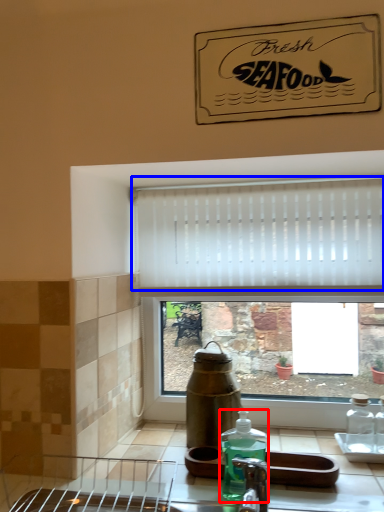
Question: Which object appears farthest to the camera in this image, bottle (highlighted by a red box) or curtain (highlighted by a blue box)?

Choices:
 (A) bottle
 (B) curtain

Answer: (B)